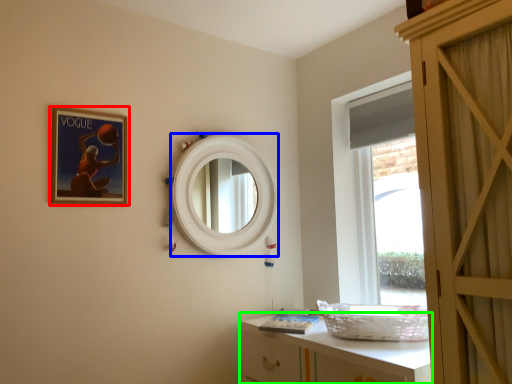
Question: Estimate the real-world distances between objects in this image. Which object is closer to picture frame (highlighted by a red box), mirror (highlighted by a blue box) or cabinetry (highlighted by a green box)?

Choices:
 (A) mirror
 (B) cabinetry

Answer: (A)